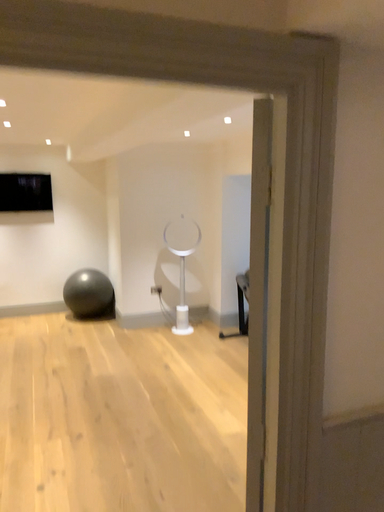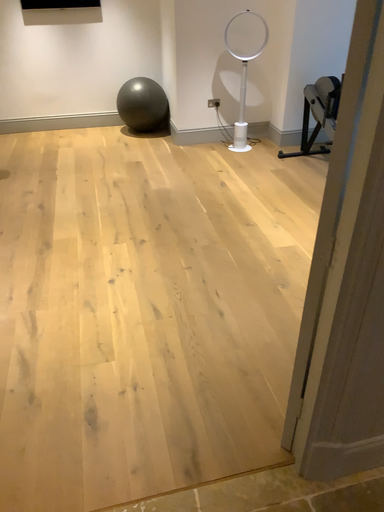
Question: Which way did the camera rotate in the video?

Choices:
 (A) rotated right
 (B) rotated left

Answer: (B)